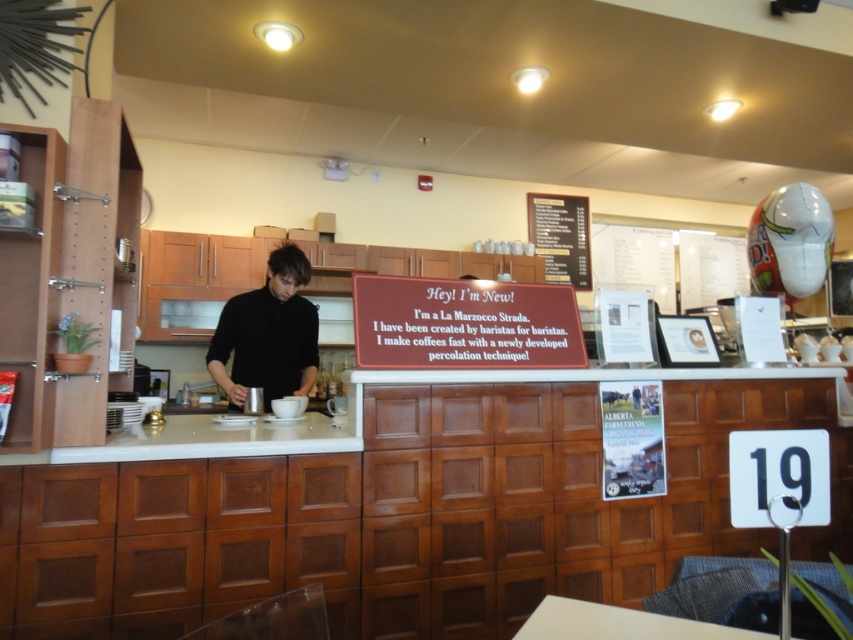
You are standing at the entrance of the coffee shop and want to approach the white laminate counter at center. Which direction should you walk to reach it?

The white laminate counter at center is located at point (x=204, y=442), so you should walk towards the center of the coffee shop to reach it.

You are standing in the coffee shop and see two points marked on the counter. The first point is at coordinates point (238,321) and the second is at point (183,440). Which point is closer to you?

Point (238,321) is closer to you because it is further to the viewer than point (183,440).

You are a customer in the coffee shop and want to place your coffee order. You see the white laminate counter at center and the white paper menu at upper right. Which object is shorter?

The white laminate counter at center is shorter than the white paper menu at upper right.